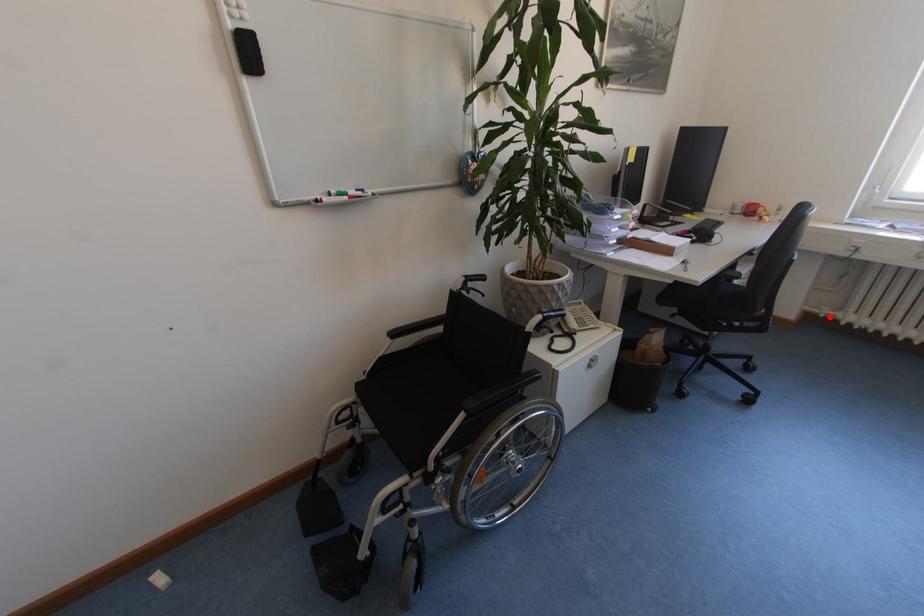
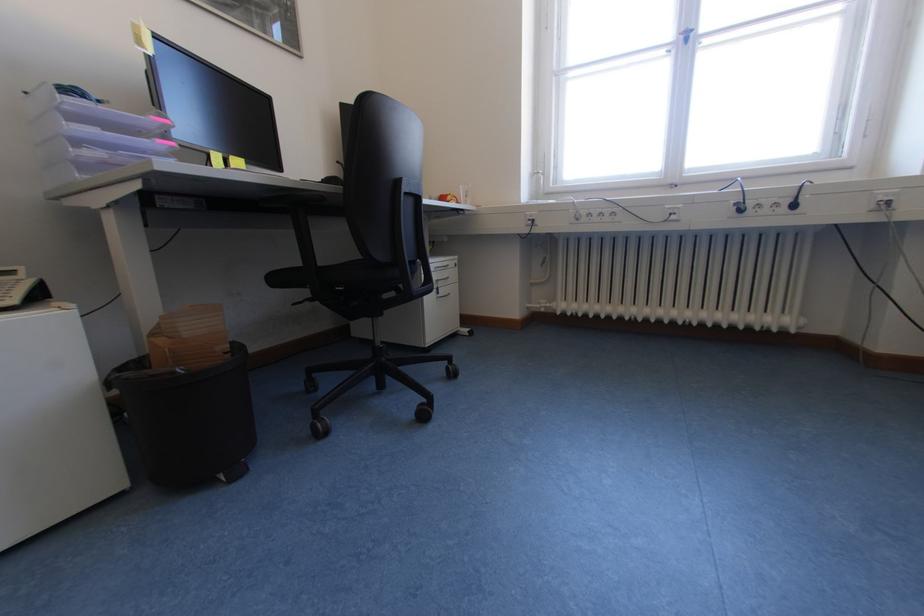
In the second image, find the point that corresponds to the highlighted location in the first image.

(551, 310)